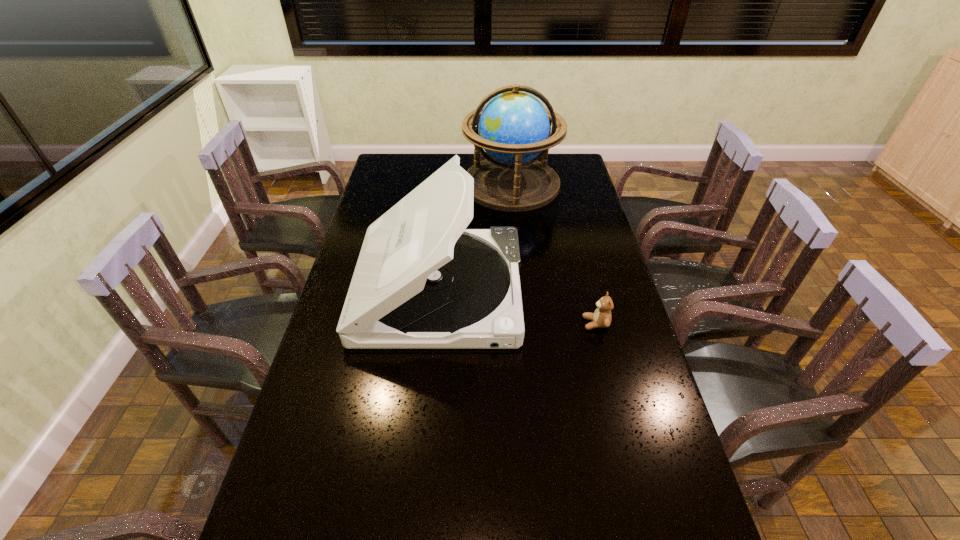
Identify the location of globe that is at the right edge. Image resolution: width=960 pixels, height=540 pixels. (514, 128).

What are the coordinates of `teddy bear that is at the right edge` in the screenshot? It's located at (601, 317).

This screenshot has width=960, height=540. I want to click on object at the far right corner, so click(x=514, y=128).

Where is `vacant point at the left edge`? The width and height of the screenshot is (960, 540). vacant point at the left edge is located at coordinates (329, 480).

Where is `vacant space at the right edge`? Image resolution: width=960 pixels, height=540 pixels. vacant space at the right edge is located at coordinates (618, 291).

What are the coordinates of `free space between the teddy bear and the globe` in the screenshot? It's located at (554, 254).

Identify which object is the second closest to the CD player. Please provide its 2D coordinates. Your answer should be formatted as a tuple, i.e. [(x, y)], where the tuple contains the x and y coordinates of a point satisfying the conditions above.

[(514, 128)]

Where is `the second closest object to the teddy bear`? the second closest object to the teddy bear is located at coordinates (514, 128).